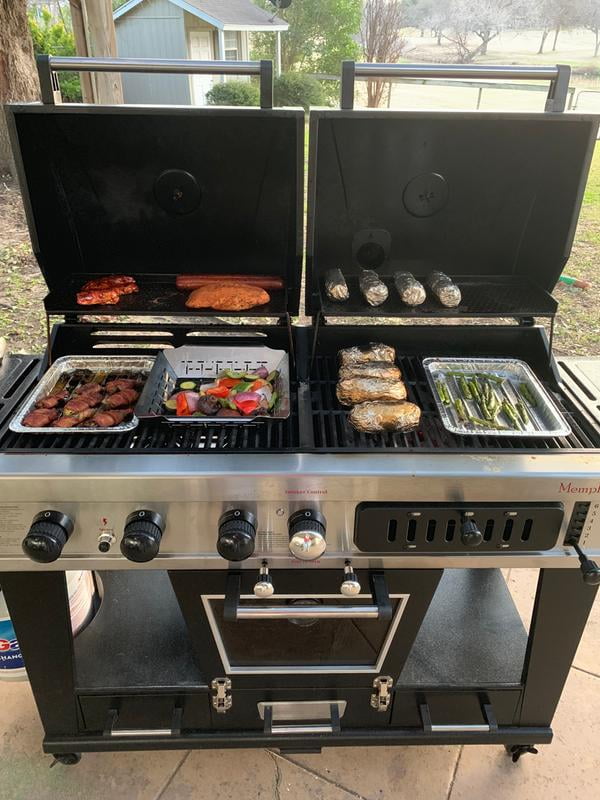
Identify the location of knob. (311, 544).